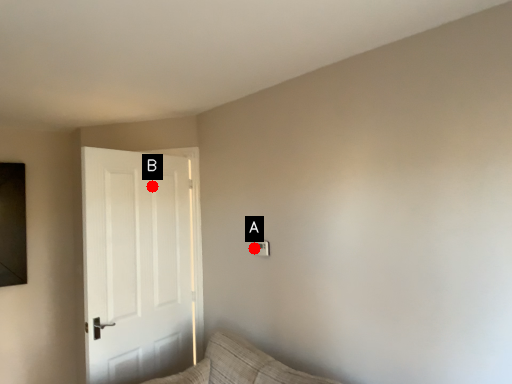
Question: Two points are circled on the image, labeled by A and B beside each circle. Which of the following is the farthest from the observer?

Choices:
 (A) A is further
 (B) B is further

Answer: (B)